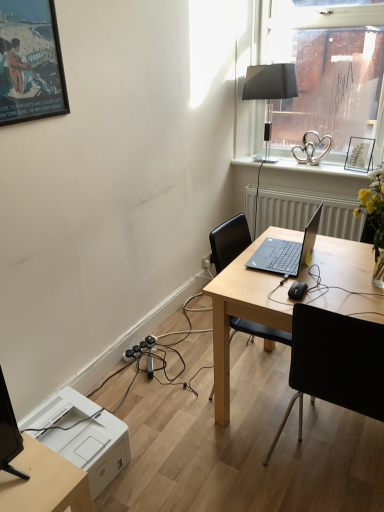
This screenshot has width=384, height=512. Find the location of `vacant area on top of white textured radiator at center (from a real-world perspective)`. vacant area on top of white textured radiator at center (from a real-world perspective) is located at coordinates (309, 189).